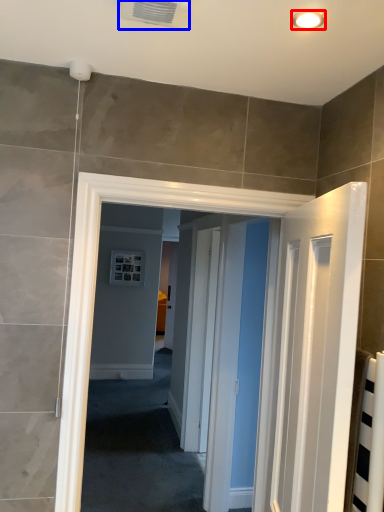
Question: Among these objects, which one is farthest to the camera, light fixture (highlighted by a red box) or air conditioning (highlighted by a blue box)?

Choices:
 (A) light fixture
 (B) air conditioning

Answer: (A)